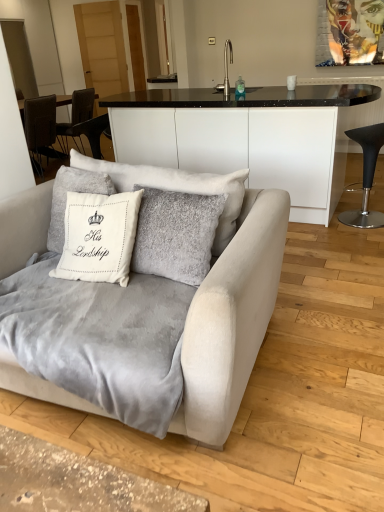
Question: In terms of height, does suede gray couch at lower left look taller or shorter compared to metallic faucet at upper center?

Choices:
 (A) tall
 (B) short

Answer: (A)

Question: Is point (233, 265) positioned closer to the camera than point (226, 89)?

Choices:
 (A) farther
 (B) closer

Answer: (B)

Question: Which of these objects is positioned farthest from the metallic faucet at upper center?

Choices:
 (A) suede gray couch at lower left
 (B) white soft cushion at center
 (C) black leather stool at right

Answer: (A)

Question: Which of these objects is positioned closest to the white soft cushion at center?

Choices:
 (A) suede gray couch at lower left
 (B) metallic faucet at upper center
 (C) black leather stool at right

Answer: (A)